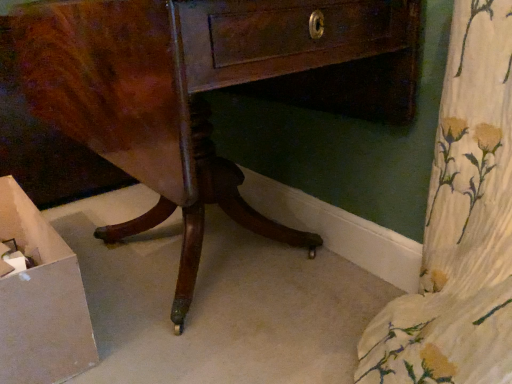
In order to click on vacant region below shiny brown wood desk at center (from a real-world perspective) in this screenshot , I will do `click(216, 274)`.